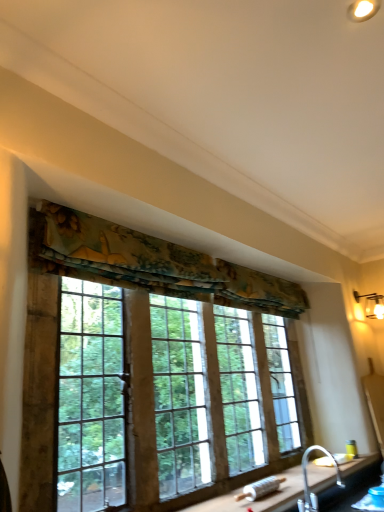
Question: Is textured fabric valance at upper center located outside textured floral fabric at upper center?

Choices:
 (A) no
 (B) yes

Answer: (B)

Question: From a real-world perspective, does textured fabric valance at upper center stand above textured floral fabric at upper center?

Choices:
 (A) yes
 (B) no

Answer: (B)

Question: Can you confirm if textured fabric valance at upper center is positioned to the left of textured floral fabric at upper center?

Choices:
 (A) yes
 (B) no

Answer: (B)

Question: From the image's perspective, is textured fabric valance at upper center over textured floral fabric at upper center?

Choices:
 (A) no
 (B) yes

Answer: (A)

Question: Is textured fabric valance at upper center aimed at textured floral fabric at upper center?

Choices:
 (A) no
 (B) yes

Answer: (B)

Question: From a real-world perspective, is textured fabric valance at upper center under textured floral fabric at upper center?

Choices:
 (A) no
 (B) yes

Answer: (B)

Question: Does textured floral fabric at upper center come behind black granite countertop at lower right?

Choices:
 (A) yes
 (B) no

Answer: (B)

Question: Is textured floral fabric at upper center far from black granite countertop at lower right?

Choices:
 (A) yes
 (B) no

Answer: (A)

Question: Could you tell me if textured floral fabric at upper center is turned towards black granite countertop at lower right?

Choices:
 (A) no
 (B) yes

Answer: (A)

Question: Can you see textured floral fabric at upper center touching black granite countertop at lower right?

Choices:
 (A) yes
 (B) no

Answer: (B)

Question: Can you confirm if textured floral fabric at upper center is taller than black granite countertop at lower right?

Choices:
 (A) no
 (B) yes

Answer: (B)

Question: Is textured floral fabric at upper center at the right side of black granite countertop at lower right?

Choices:
 (A) no
 (B) yes

Answer: (A)

Question: Does silver metallic faucet at lower right have a larger size compared to matte white wall sconce at upper right?

Choices:
 (A) no
 (B) yes

Answer: (B)